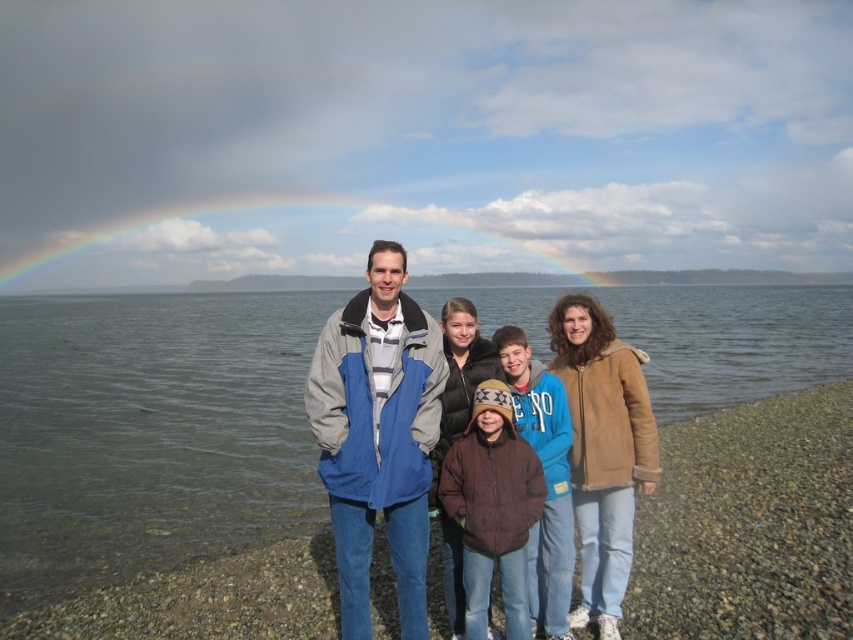
Looking at this image, who is positioned more to the right, clear water at center or blue and gray jacket at center?

Positioned to the right is blue and gray jacket at center.

Who is taller, clear water at center or blue and gray jacket at center?

clear water at center is taller.

The height and width of the screenshot is (640, 853). What are the coordinates of `clear water at center` in the screenshot? It's located at (149, 432).

Where is `clear water at center`? The height and width of the screenshot is (640, 853). clear water at center is located at coordinates (149, 432).

Is blue and gray jacket at center to the left of brown fuzzy jacket at center from the viewer's perspective?

Correct, you'll find blue and gray jacket at center to the left of brown fuzzy jacket at center.

From the picture: Can you confirm if blue and gray jacket at center is wider than brown fuzzy jacket at center?

Yes.

Between point (346, 344) and point (512, 628), which one is positioned behind?

The point (346, 344) is behind.

The image size is (853, 640). In order to click on blue and gray jacket at center in this screenshot , I will do `click(378, 435)`.

Does clear water at center have a smaller size compared to brown fuzzy jacket at center?

No.

Can you confirm if clear water at center is taller than brown fuzzy jacket at center?

Yes.

Which is behind, point (86, 314) or point (486, 618)?

The point (86, 314) is behind.

This screenshot has width=853, height=640. In order to click on clear water at center in this screenshot , I will do `click(149, 432)`.